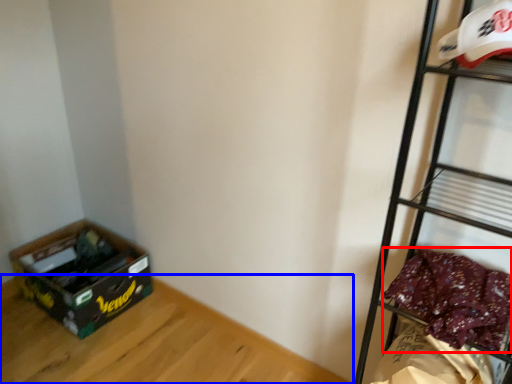
Question: Which of the following is the farthest to the observer, clothing (highlighted by a red box) or furniture (highlighted by a blue box)?

Choices:
 (A) clothing
 (B) furniture

Answer: (B)